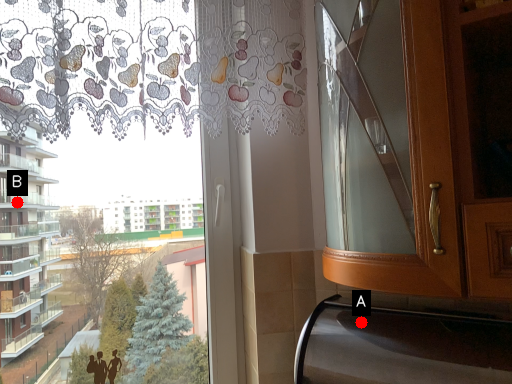
Question: Two points are circled on the image, labeled by A and B beside each circle. Which point is farther to the camera?

Choices:
 (A) A is further
 (B) B is further

Answer: (B)